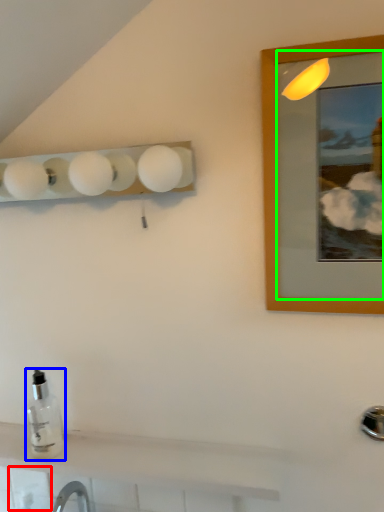
Question: Which is farther away from tile (highlighted by a red box)? bottle (highlighted by a blue box) or mirror (highlighted by a green box)?

Choices:
 (A) bottle
 (B) mirror

Answer: (B)